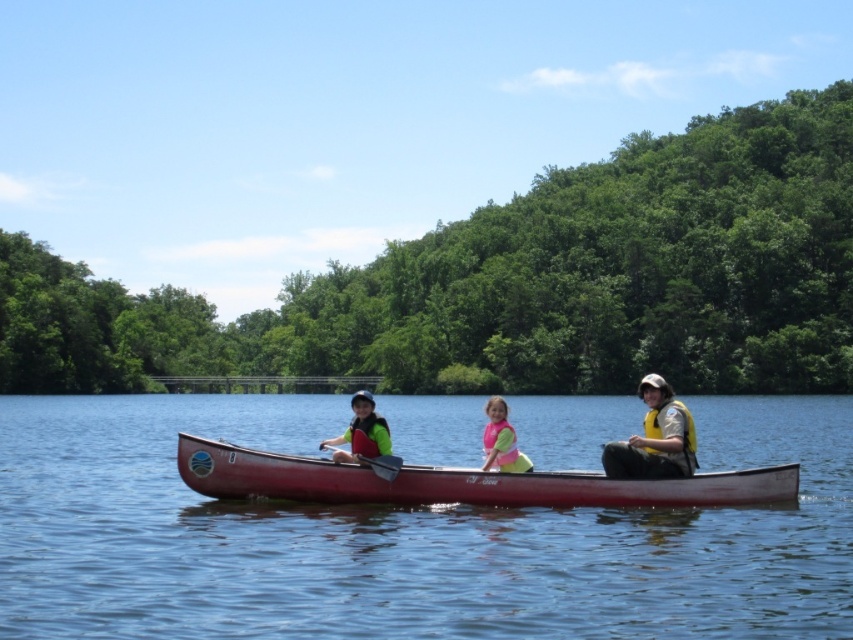
Can you confirm if smooth red canoe at center is positioned to the left of yellow life vest at right?

Indeed, smooth red canoe at center is positioned on the left side of yellow life vest at right.

Consider the image. Does smooth red canoe at center have a smaller size compared to yellow life vest at right?

Correct, smooth red canoe at center occupies less space than yellow life vest at right.

The width and height of the screenshot is (853, 640). What do you see at coordinates (460, 483) in the screenshot?
I see `smooth red canoe at center` at bounding box center [460, 483].

Where is `smooth red canoe at center`? Image resolution: width=853 pixels, height=640 pixels. smooth red canoe at center is located at coordinates (460, 483).

Is yellow life vest at right in front of matte green life vest at center?

Yes, it is.

Measure the distance between yellow life vest at right and camera.

yellow life vest at right is 71.80 feet away from camera.

Find the location of `yellow life vest at right`. yellow life vest at right is located at coordinates (654, 438).

Which is more to the left, smooth blue water at center or yellow life vest at right?

Positioned to the left is smooth blue water at center.

At what (x,y) coordinates should I click in order to perform the action: click on smooth blue water at center. Please return your answer as a coordinate pair (x, y). Looking at the image, I should click on (402, 536).

The height and width of the screenshot is (640, 853). What are the coordinates of `smooth blue water at center` in the screenshot? It's located at click(x=402, y=536).